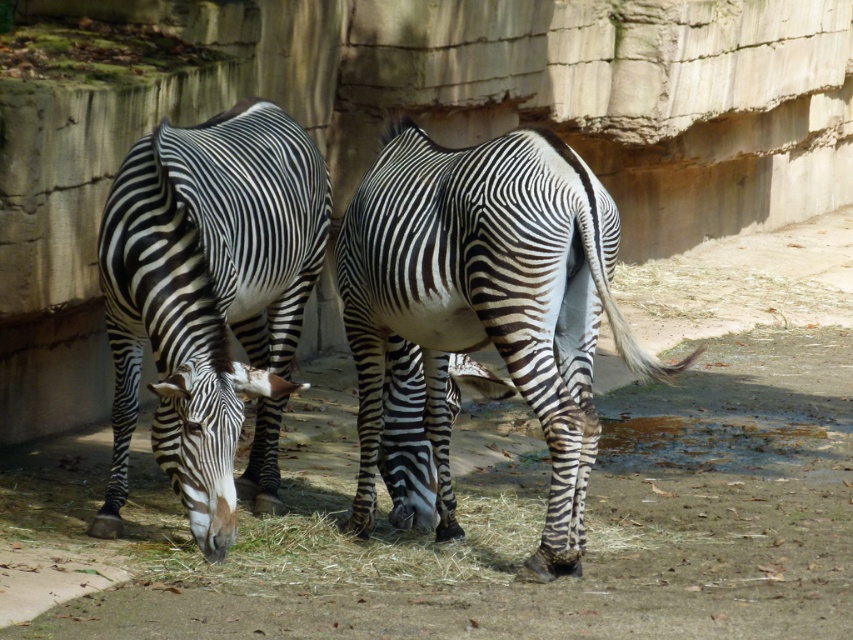
You are a zookeeper trying to locate the black and white striped zebra at center in the enclosure. The enclosure has a coordinate system where the bottom left corner is the origin. Can you confirm if the zebra is located at point (486, 300)?

Yes, the black and white striped zebra at center is located at point (486, 300) as indicated by the coordinate system.

You are a zookeeper who needs to feed the zebras. You have a limited amount of hay. Which zebra, the black and white striped zebra at center or the black and white striped zebra at left, would you prioritize feeding first based on their size?

The black and white striped zebra at center is bigger than the black and white striped zebra at left, so you should prioritize feeding the black and white striped zebra at center first to ensure it gets enough hay.

You are a zookeeper standing at the camera position. You need to feed the black and white striped zebra at center. If your feeding tool has a maximum reach of 5 meters, can you reach the zebra?

The black and white striped zebra at center and camera are 4.90 meters apart from each other, so yes, the feeding tool can reach the zebra since its maximum reach is 5 meters, which is slightly longer than the distance.